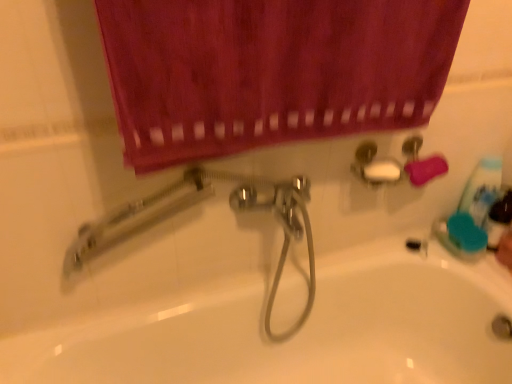
At what (x,y) coordinates should I click in order to perform the action: click on smooth skin hand at lower right. Please return your answer as a coordinate pair (x, y). The image size is (512, 384). Looking at the image, I should click on (505, 250).

What do you see at coordinates (505, 250) in the screenshot? I see `smooth skin hand at lower right` at bounding box center [505, 250].

The height and width of the screenshot is (384, 512). Describe the element at coordinates (498, 220) in the screenshot. I see `blue plastic mouthwash at right` at that location.

You are a GUI agent. You are given a task and a screenshot of the screen. Output one action in this format:
    pyautogui.click(x=<x>, y=<y>)
    Task: Click on the blue plastic mouthwash at right
    The height and width of the screenshot is (384, 512).
    Given the screenshot: What is the action you would take?
    pyautogui.click(x=498, y=220)

Looking at this image, measure the distance between white glossy bathtub at center and camera.

white glossy bathtub at center and camera are 36.19 inches apart.

In order to click on white glossy bathtub at center in this screenshot , I will do `click(296, 334)`.

The height and width of the screenshot is (384, 512). I want to click on smooth skin hand at lower right, so click(x=505, y=250).

Is point (429, 325) closer to camera compared to point (436, 60)?

No, (429, 325) is further to viewer.

Looking at this image, between white glossy bathtub at center and velvet-like maroon curtain at upper center, which one has more height?

white glossy bathtub at center is taller.

In the scene shown: From a real-world perspective, is white glossy bathtub at center over velvet-like maroon curtain at upper center?

Incorrect, from a real-world perspective, white glossy bathtub at center is lower than velvet-like maroon curtain at upper center.

In the scene shown: Is white glossy bathtub at center not near velvet-like maroon curtain at upper center?

They are positioned close to each other.

Find the location of `mouthwash on the right of velvet-like maroon curtain at upper center`. mouthwash on the right of velvet-like maroon curtain at upper center is located at coordinates (498, 220).

Is blue plastic mouthwash at right not close to velvet-like maroon curtain at upper center?

No.

Who is smaller, blue plastic mouthwash at right or velvet-like maroon curtain at upper center?

With smaller size is blue plastic mouthwash at right.

Based on their sizes in the image, would you say velvet-like maroon curtain at upper center is bigger or smaller than smooth skin hand at lower right?

In the image, velvet-like maroon curtain at upper center appears to be larger than smooth skin hand at lower right.

Is the depth of velvet-like maroon curtain at upper center less than that of smooth skin hand at lower right?

Yes, it is in front of smooth skin hand at lower right.

Is velvet-like maroon curtain at upper center positioned beyond the bounds of smooth skin hand at lower right?

Yes, velvet-like maroon curtain at upper center is not within smooth skin hand at lower right.

Which object is wider, smooth skin hand at lower right or white glossy bathtub at center?

white glossy bathtub at center.

The height and width of the screenshot is (384, 512). What are the coordinates of `hand behind the white glossy bathtub at center` in the screenshot? It's located at (505, 250).

Does smooth skin hand at lower right turn towards white glossy bathtub at center?

Yes, smooth skin hand at lower right faces towards white glossy bathtub at center.

From the image's perspective, which one is positioned lower, smooth skin hand at lower right or white glossy bathtub at center?

white glossy bathtub at center is shown below in the image.

Is smooth skin hand at lower right positioned far away from blue plastic mouthwash at right?

smooth skin hand at lower right is actually quite close to blue plastic mouthwash at right.

What's the angular difference between smooth skin hand at lower right and blue plastic mouthwash at right's facing directions?

There is a 0.000716-degree angle between the facing directions of smooth skin hand at lower right and blue plastic mouthwash at right.

Which object is thinner, smooth skin hand at lower right or blue plastic mouthwash at right?

→ Thinner between the two is blue plastic mouthwash at right.

Could you tell me if smooth skin hand at lower right is turned towards blue plastic mouthwash at right?

No, smooth skin hand at lower right is not facing towards blue plastic mouthwash at right.

From a real-world perspective, which is physically below, white glossy bathtub at center or smooth skin hand at lower right?

In real-world perspective, white glossy bathtub at center is lower.

Which object is wider, white glossy bathtub at center or smooth skin hand at lower right?

white glossy bathtub at center.

The height and width of the screenshot is (384, 512). I want to click on hand above the white glossy bathtub at center (from a real-world perspective), so click(x=505, y=250).

In the scene shown: Is white glossy bathtub at center not close to smooth skin hand at lower right?

white glossy bathtub at center is near smooth skin hand at lower right, not far away.

Looking at this image, between blue plastic mouthwash at right and smooth skin hand at lower right, which one appears on the right side from the viewer's perspective?

Positioned to the right is smooth skin hand at lower right.

Does point (496, 246) appear closer or farther from the camera than point (505, 265)?

Point (496, 246) appears to be farther away from the viewer than point (505, 265).

From the image's perspective, between blue plastic mouthwash at right and smooth skin hand at lower right, which one is located above?

blue plastic mouthwash at right is shown above in the image.

What are the coordinates of `bath to the right of velvet-like maroon curtain at upper center` in the screenshot? It's located at (296, 334).

The width and height of the screenshot is (512, 384). Identify the location of mouthwash located underneath the velvet-like maroon curtain at upper center (from a real-world perspective). (498, 220).

From the image, which object appears to be nearer to velvet-like maroon curtain at upper center, white glossy bathtub at center or smooth skin hand at lower right?

white glossy bathtub at center is positioned closer to the anchor velvet-like maroon curtain at upper center.

Which object lies further to the anchor point white glossy bathtub at center, smooth skin hand at lower right or velvet-like maroon curtain at upper center?

velvet-like maroon curtain at upper center.

Estimate the real-world distances between objects in this image. Which object is further from blue plastic mouthwash at right, velvet-like maroon curtain at upper center or white glossy bathtub at center?

velvet-like maroon curtain at upper center is further to blue plastic mouthwash at right.

Estimate the real-world distances between objects in this image. Which object is closer to smooth skin hand at lower right, blue plastic mouthwash at right or velvet-like maroon curtain at upper center?

blue plastic mouthwash at right is closer to smooth skin hand at lower right.

Estimate the real-world distances between objects in this image. Which object is further from velvet-like maroon curtain at upper center, smooth skin hand at lower right or blue plastic mouthwash at right?

smooth skin hand at lower right is positioned further to the anchor velvet-like maroon curtain at upper center.

Estimate the real-world distances between objects in this image. Which object is further from white glossy bathtub at center, blue plastic mouthwash at right or velvet-like maroon curtain at upper center?

Among the two, velvet-like maroon curtain at upper center is located further to white glossy bathtub at center.

Based on their spatial positions, is blue plastic mouthwash at right or white glossy bathtub at center closer to smooth skin hand at lower right?

The object closer to smooth skin hand at lower right is blue plastic mouthwash at right.

Which object lies further to the anchor point smooth skin hand at lower right, white glossy bathtub at center or velvet-like maroon curtain at upper center?

velvet-like maroon curtain at upper center is further to smooth skin hand at lower right.

Locate an element on the screen. The image size is (512, 384). bath between velvet-like maroon curtain at upper center and smooth skin hand at lower right is located at coordinates (296, 334).

Find the location of a particular element. Image resolution: width=512 pixels, height=384 pixels. mouthwash between velvet-like maroon curtain at upper center and white glossy bathtub at center in the up-down direction is located at coordinates (498, 220).

Identify the location of mouthwash between velvet-like maroon curtain at upper center and smooth skin hand at lower right. The height and width of the screenshot is (384, 512). (498, 220).

Locate an element on the screen. The width and height of the screenshot is (512, 384). mouthwash between white glossy bathtub at center and smooth skin hand at lower right from left to right is located at coordinates (498, 220).